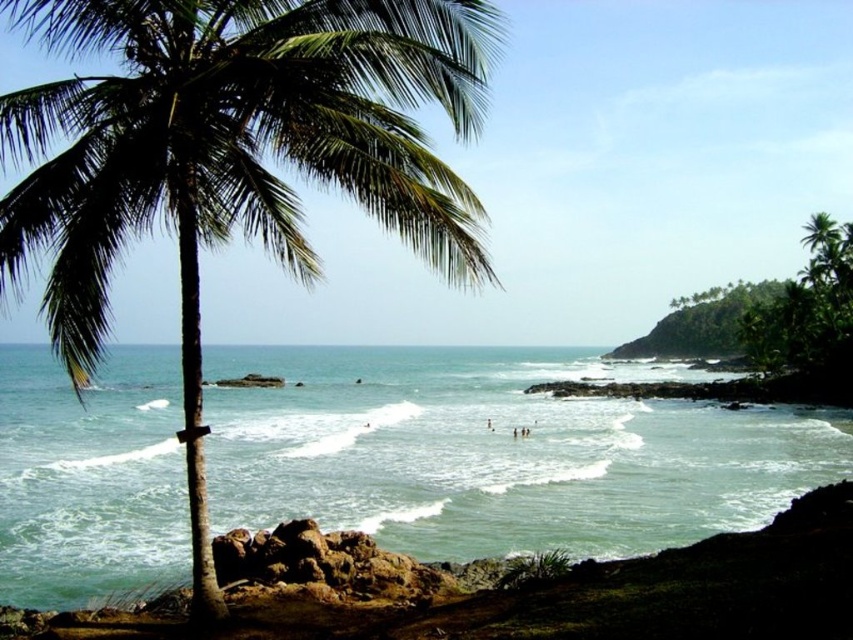
Question: Which point is closer to the camera taking this photo?

Choices:
 (A) (514, 435)
 (B) (38, 620)
 (C) (279, 44)

Answer: (C)

Question: Considering the real-world distances, which object is closest to the green leafy palm tree at left?

Choices:
 (A) skinny person at center
 (B) green water at center

Answer: (B)

Question: In this image, where is green water at center located relative to skinny person at center?

Choices:
 (A) above
 (B) below

Answer: (B)

Question: Which point is closer to the camera taking this photo?

Choices:
 (A) (546, 349)
 (B) (512, 432)
 (C) (225, 42)

Answer: (C)

Question: Is green water at center to the right of green leafy palm tree at left from the viewer's perspective?

Choices:
 (A) no
 (B) yes

Answer: (A)

Question: Can you confirm if green water at center is positioned to the left of skinny person at center?

Choices:
 (A) no
 (B) yes

Answer: (B)